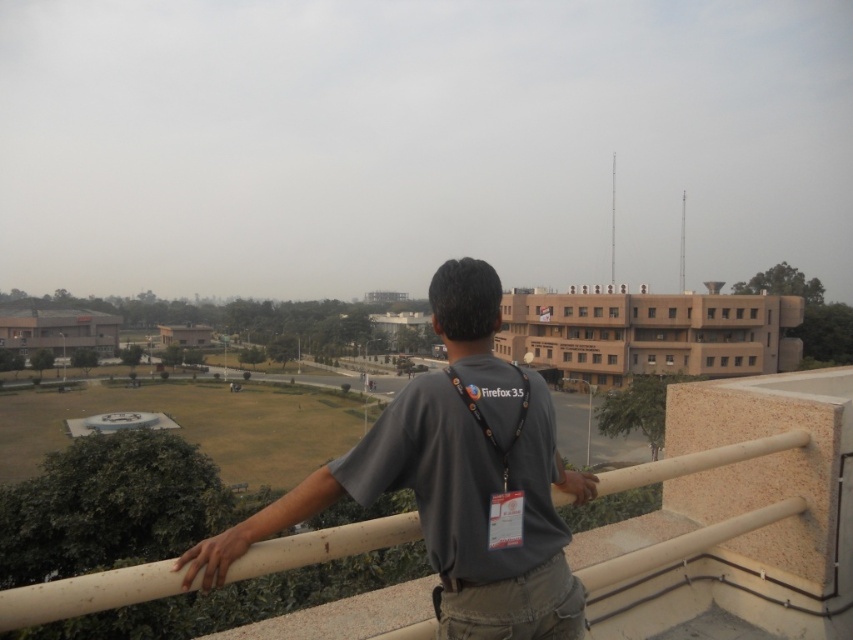
Question: Does gray fabric shirt at center have a smaller size compared to beige concrete railing at center?

Choices:
 (A) yes
 (B) no

Answer: (A)

Question: Does gray fabric shirt at center have a lesser width compared to beige concrete railing at center?

Choices:
 (A) no
 (B) yes

Answer: (B)

Question: Is gray fabric shirt at center smaller than beige concrete railing at center?

Choices:
 (A) yes
 (B) no

Answer: (A)

Question: Which point appears closest to the camera in this image?

Choices:
 (A) (210, 579)
 (B) (94, 579)

Answer: (B)